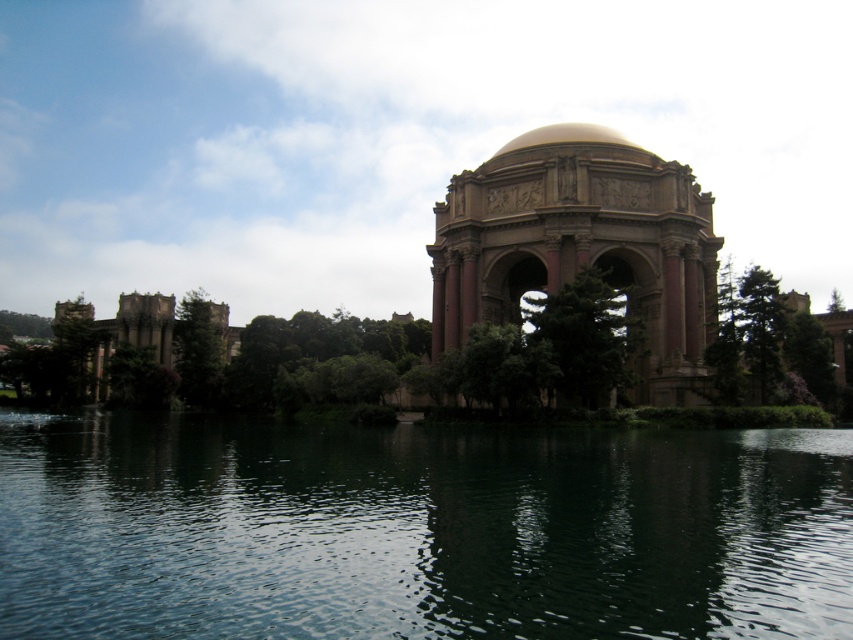
Is point (627, 260) less distant than point (770, 317)?

No, it is behind (770, 317).

At what (x,y) coordinates should I click in order to perform the action: click on marble-like pink archway at center. Please return your answer as a coordinate pair (x, y). The width and height of the screenshot is (853, 640). Looking at the image, I should click on (582, 246).

Which is behind, point (660, 301) or point (763, 296)?

The point (660, 301) is more distant.

The height and width of the screenshot is (640, 853). I want to click on marble-like pink archway at center, so pyautogui.click(x=582, y=246).

Is point (210, 300) positioned in front of point (537, 144)?

No.

Looking at this image, does green leafy tree at left have a lesser width compared to gold polished dome at upper center?

Indeed, green leafy tree at left has a lesser width compared to gold polished dome at upper center.

Identify the location of green leafy tree at left. click(x=199, y=346).

Between green leafy tree at left and green textured tree at right, which one has less height?

green textured tree at right is shorter.

Is point (206, 374) less distant than point (781, 378)?

No, it is behind (781, 378).

Is point (193, 332) positioned behind point (764, 369)?

That is True.

Identify the location of green leafy tree at left. (199, 346).